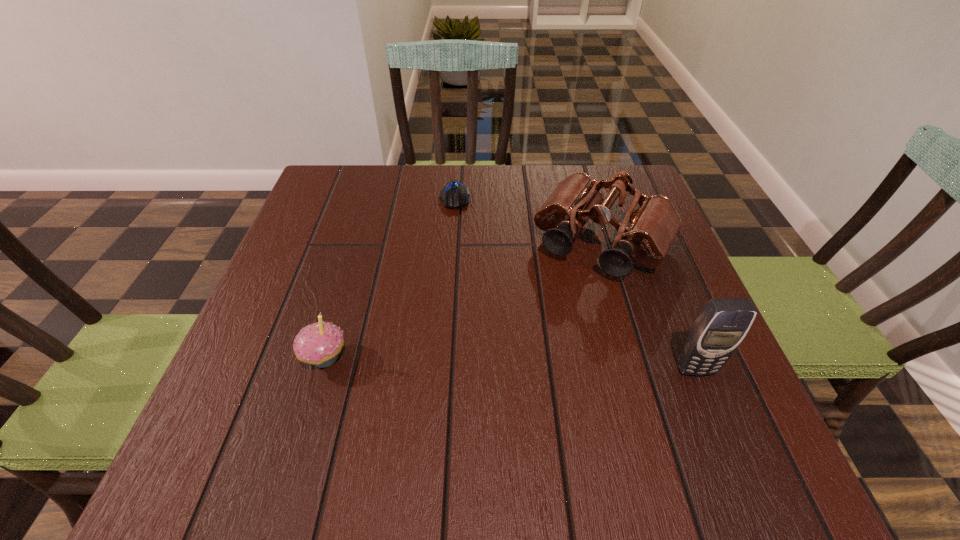
Where is `vacant space in between the third shortest object and the second shortest object`? vacant space in between the third shortest object and the second shortest object is located at coordinates (464, 300).

Identify which object is located as the second nearest to the tallest object. Please provide its 2D coordinates. Your answer should be formatted as a tuple, i.e. [(x, y)], where the tuple contains the x and y coordinates of a point satisfying the conditions above.

[(319, 344)]

Identify which object is the second closest to the computer mouse. Please provide its 2D coordinates. Your answer should be formatted as a tuple, i.e. [(x, y)], where the tuple contains the x and y coordinates of a point satisfying the conditions above.

[(319, 344)]

Image resolution: width=960 pixels, height=540 pixels. Find the location of `free space that satisfies the following two spatial constraints: 1. on the back side of the second shortest object; 2. on the left side of the third shortest object`. free space that satisfies the following two spatial constraints: 1. on the back side of the second shortest object; 2. on the left side of the third shortest object is located at coordinates (359, 243).

Locate an element on the screen. This screenshot has height=540, width=960. free spot that satisfies the following two spatial constraints: 1. on the back side of the cupcake; 2. on the left side of the binoculars is located at coordinates click(x=359, y=243).

Identify the location of vacant area in the image that satisfies the following two spatial constraints: 1. on the front side of the computer mouse; 2. on the left side of the third shortest object. pos(451,243).